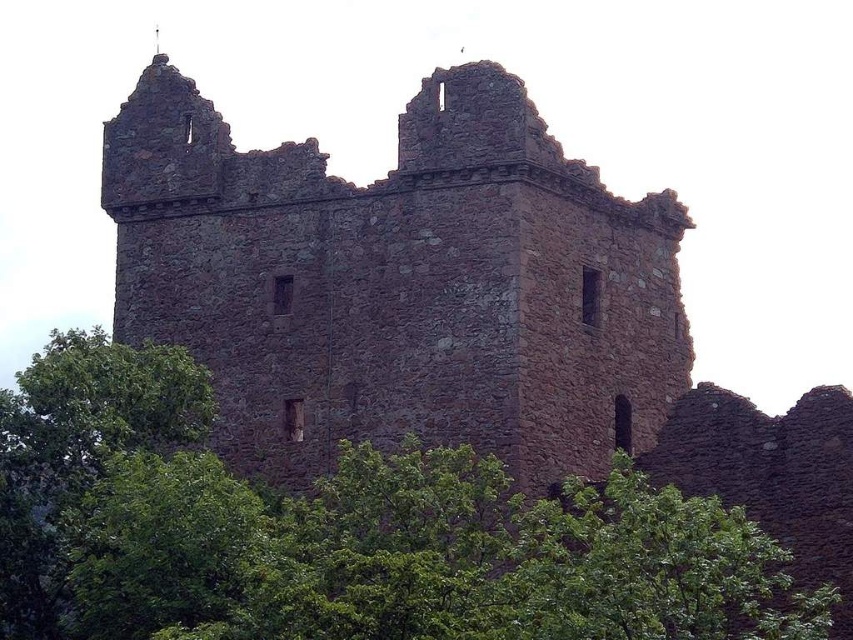
In the scene shown: Can you confirm if brown stone ruins at center is wider than green leafy tree at center?

In fact, brown stone ruins at center might be narrower than green leafy tree at center.

How distant is brown stone ruins at center from green leafy tree at center?

9.84 meters

Does point (170, 88) lie behind point (24, 560)?

Yes, point (170, 88) is farther from viewer.

You are a GUI agent. You are given a task and a screenshot of the screen. Output one action in this format:
    pyautogui.click(x=<x>, y=<y>)
    Task: Click on the brown stone ruins at center
    Image resolution: width=853 pixels, height=640 pixels.
    Given the screenshot: What is the action you would take?
    pyautogui.click(x=399, y=282)